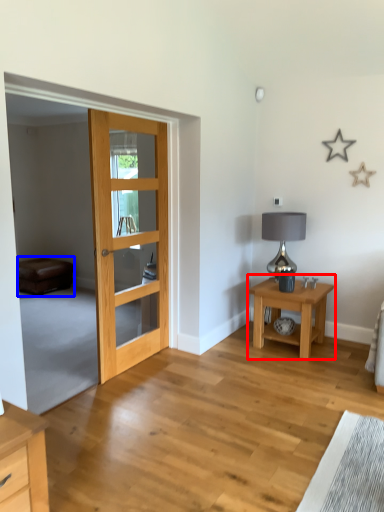
Question: Which object appears closest to the camera in this image, nightstand (highlighted by a red box) or couch (highlighted by a blue box)?

Choices:
 (A) nightstand
 (B) couch

Answer: (A)